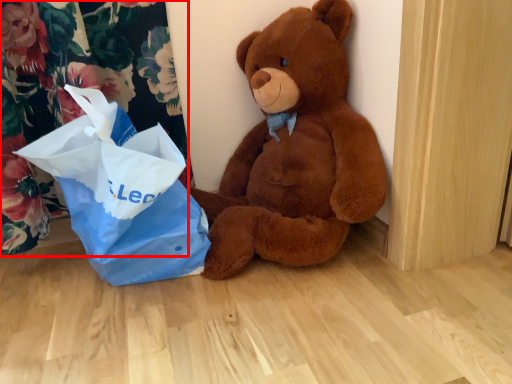
Question: From the image's perspective, where is curtain (annotated by the red box) located relative to teddy bear?

Choices:
 (A) below
 (B) above

Answer: (A)